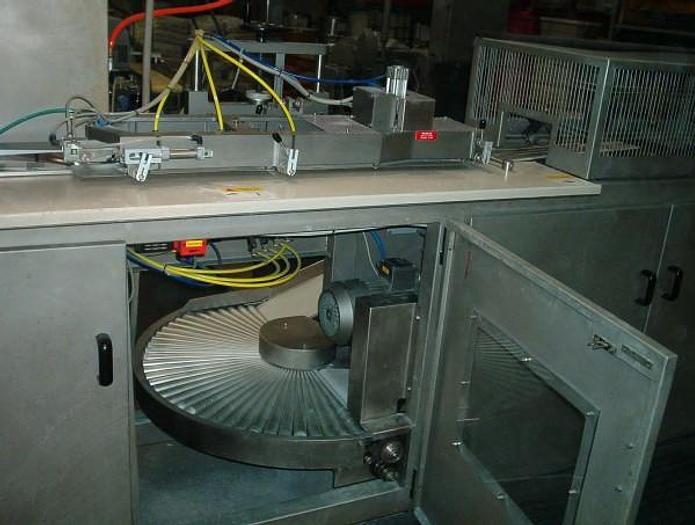
Image resolution: width=695 pixels, height=525 pixels. In order to click on door in this screenshot , I will do `click(580, 344)`, `click(79, 404)`.